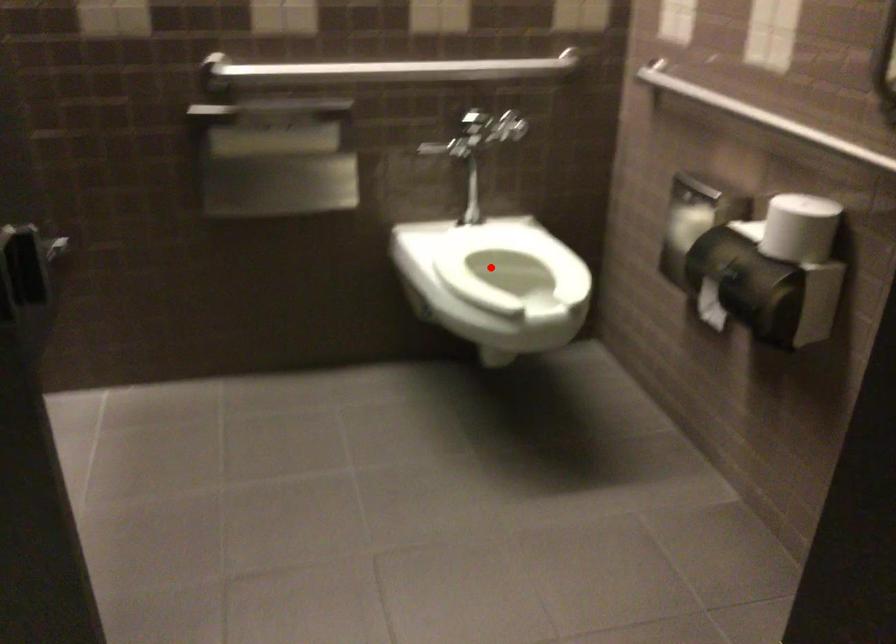
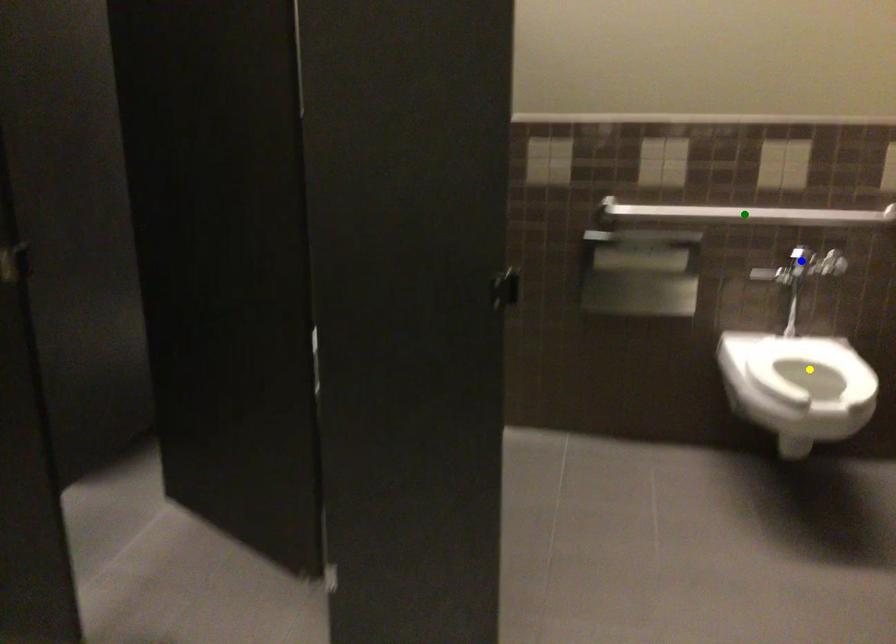
Question: I am providing you with two images of the same scene from different viewpoints. A red point is marked on the first image. You are given multiple points on the second image. In image 2, which mark is for the same physical point as the one in image 1?

Choices:
 (A) green point
 (B) yellow point
 (C) blue point

Answer: (B)